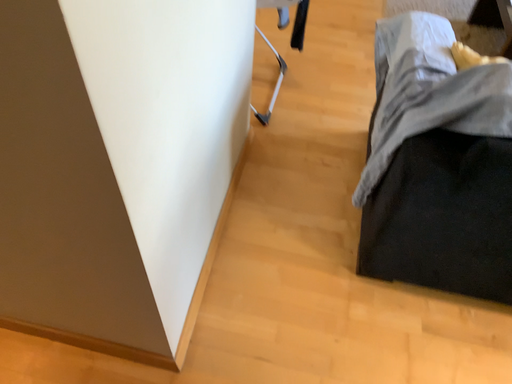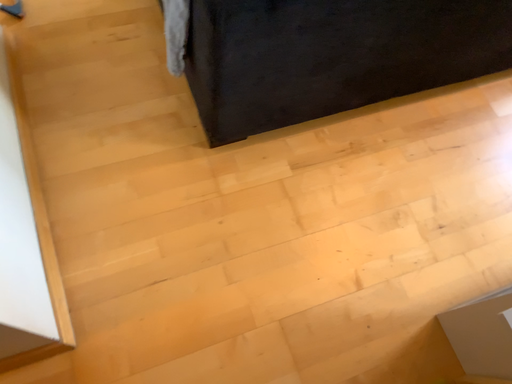
Question: How did the camera likely rotate when shooting the video?

Choices:
 (A) rotated downward
 (B) rotated upward

Answer: (A)